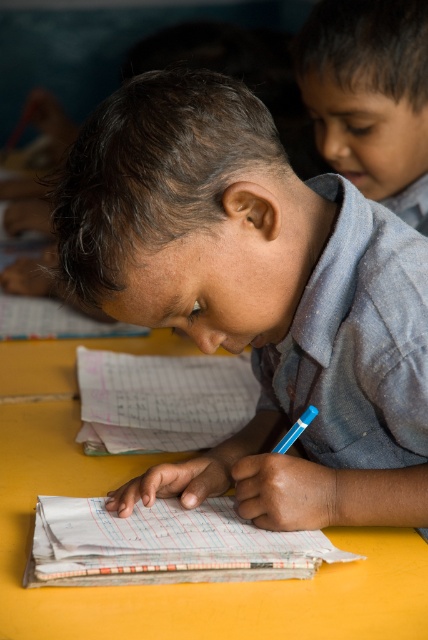
Question: Which of these objects is positioned closest to the matte blue shirt at center?

Choices:
 (A) blue plastic pencil at center
 (B) yellow matte table at center
 (C) smooth blue shirt at upper right

Answer: (A)

Question: Which point is closer to the camera taking this photo?

Choices:
 (A) (303, 413)
 (B) (380, 324)

Answer: (B)

Question: Is matte blue shirt at center bigger than smooth blue shirt at upper right?

Choices:
 (A) no
 (B) yes

Answer: (B)

Question: Which of the following is the farthest from the observer?

Choices:
 (A) (368, 106)
 (B) (401, 221)
 (C) (333, 554)
 (D) (309, 410)

Answer: (A)

Question: From the image, what is the correct spatial relationship of yellow matte table at center in relation to smooth blue shirt at upper right?

Choices:
 (A) above
 (B) below

Answer: (B)

Question: Where is smooth blue shirt at upper right located in relation to white paper notebook at center in the image?

Choices:
 (A) right
 (B) left

Answer: (A)